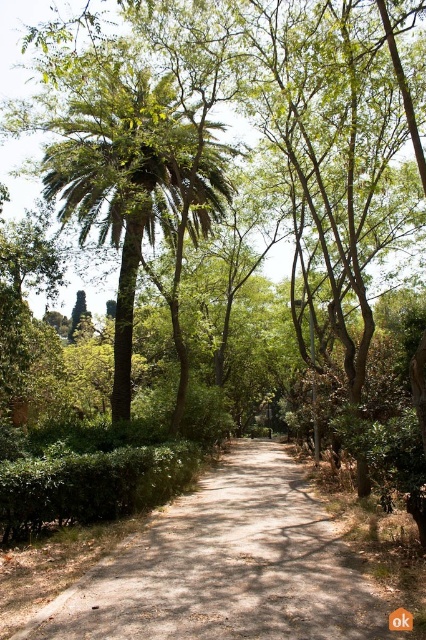
Which is more to the left, dirt path at center or green leafy palm tree at upper left?

green leafy palm tree at upper left

Can you confirm if dirt path at center is positioned below green leafy palm tree at upper left?

Correct, dirt path at center is located below green leafy palm tree at upper left.

This screenshot has height=640, width=426. In order to click on dirt path at center in this screenshot , I will do `click(227, 566)`.

Locate an element on the screen. dirt path at center is located at coordinates (227, 566).